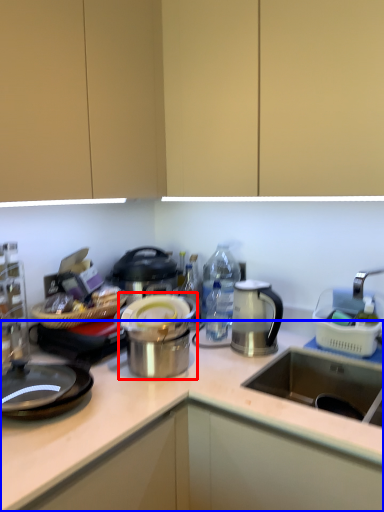
Question: Among these objects, which one is nearest to the camera, appliance (highlighted by a red box) or countertop (highlighted by a blue box)?

Choices:
 (A) appliance
 (B) countertop

Answer: (B)